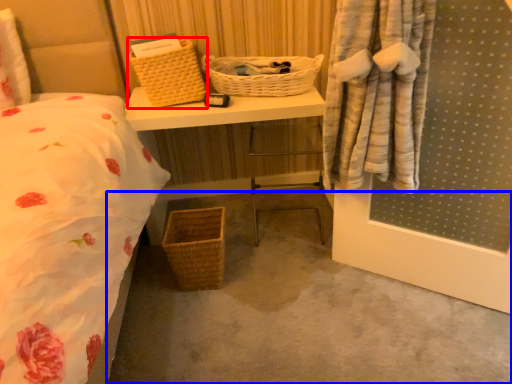
Question: Among these objects, which one is farthest to the camera, picnic basket (highlighted by a red box) or concrete (highlighted by a blue box)?

Choices:
 (A) picnic basket
 (B) concrete

Answer: (A)